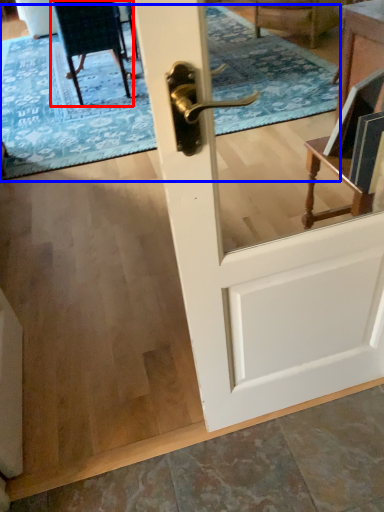
Question: Which object appears closest to the camera in this image, chair (highlighted by a red box) or doormat (highlighted by a blue box)?

Choices:
 (A) chair
 (B) doormat

Answer: (B)